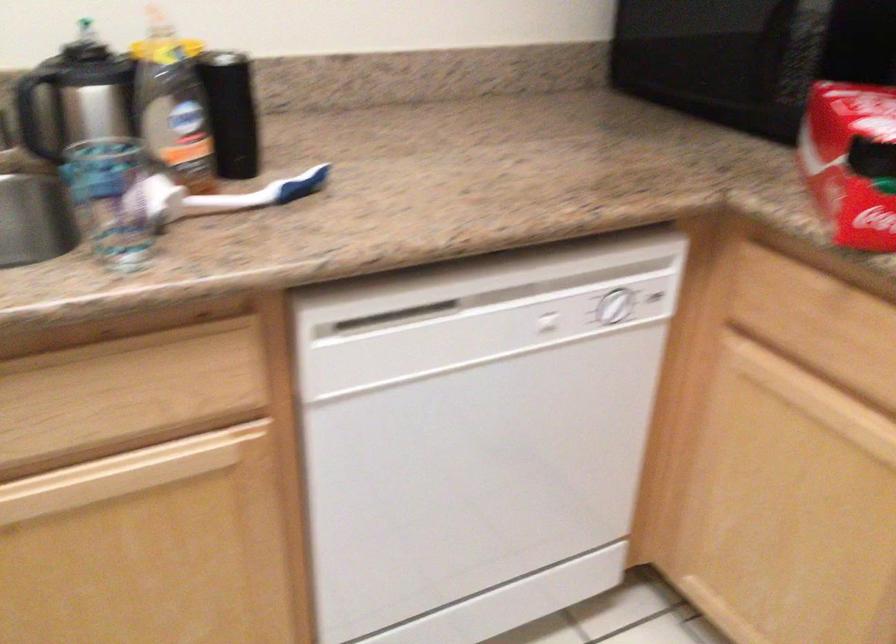
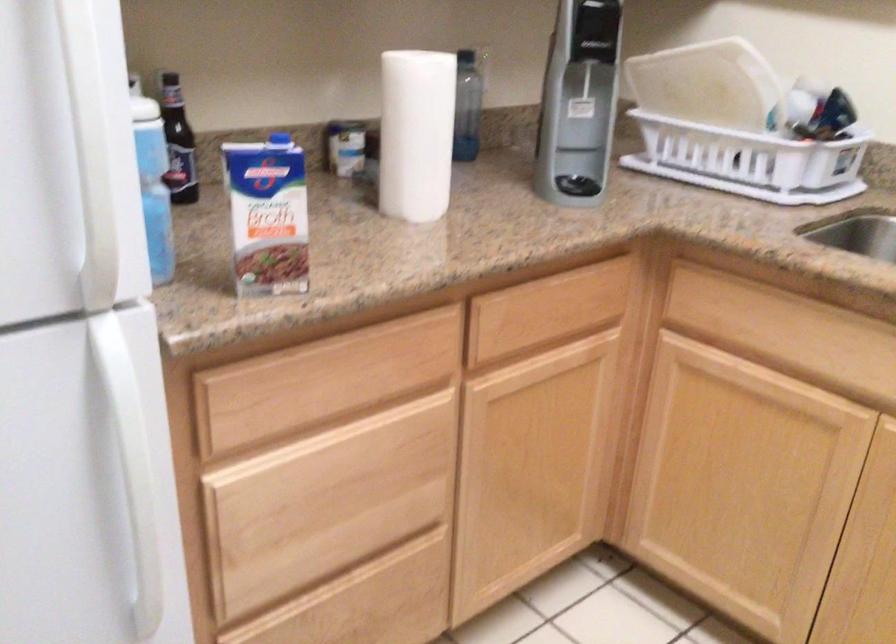
Question: The first image is from the beginning of the video and the second image is from the end. How did the camera likely rotate when shooting the video?

Choices:
 (A) Left
 (B) Right
 (C) Up
 (D) Down

Answer: (A)